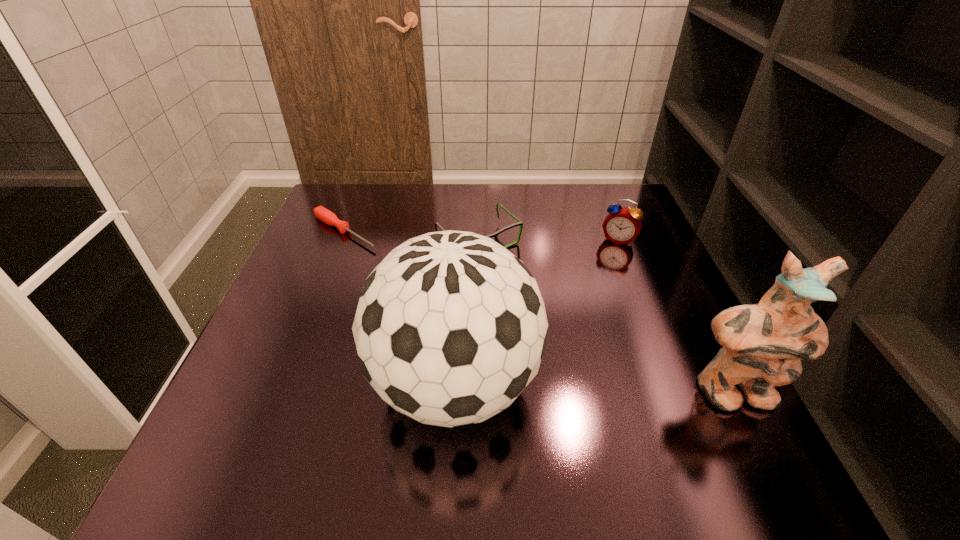
Where is `vacant spot on the desktop that is between the soccer ball and the figurine and is positioned on the lens of the second shortest object`? Image resolution: width=960 pixels, height=540 pixels. vacant spot on the desktop that is between the soccer ball and the figurine and is positioned on the lens of the second shortest object is located at coordinates (625, 390).

Where is `vacant space on the desktop that is between the soccer ball and the figurine and is positioned on the front-facing side of the third shortest object`? This screenshot has height=540, width=960. vacant space on the desktop that is between the soccer ball and the figurine and is positioned on the front-facing side of the third shortest object is located at coordinates (563, 388).

You are a GUI agent. You are given a task and a screenshot of the screen. Output one action in this format:
    pyautogui.click(x=<x>, y=<y>)
    Task: Click on the free spot on the desktop that is between the soccer ball and the figurine and is positioned at the tip of the leftmost object
    The image size is (960, 540).
    Given the screenshot: What is the action you would take?
    pyautogui.click(x=592, y=389)